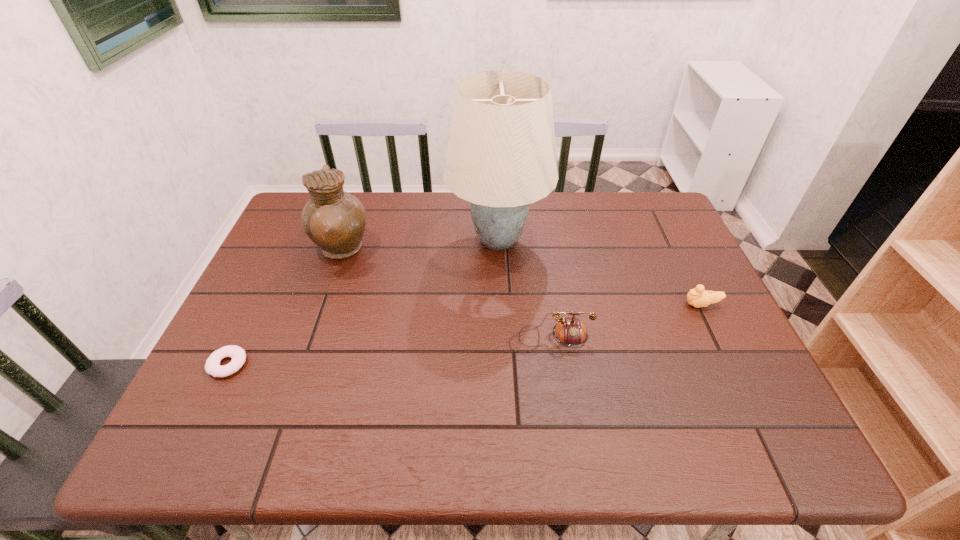
Find the location of a particular element. the tallest object is located at coordinates (501, 156).

This screenshot has height=540, width=960. I want to click on the second object from left to right, so click(x=335, y=220).

I want to click on the fourth shortest object, so click(335, 220).

This screenshot has height=540, width=960. I want to click on telephone, so click(x=570, y=332).

Find the location of a particular element. the rightmost object is located at coordinates (698, 297).

Where is `the third nearest object`? the third nearest object is located at coordinates (698, 297).

Where is `the shortest object`? The width and height of the screenshot is (960, 540). the shortest object is located at coordinates (212, 367).

Find the location of `the leftmost object`. the leftmost object is located at coordinates (212, 367).

The width and height of the screenshot is (960, 540). What are the coordinates of `vacant space located on the front of the tallest object` in the screenshot? It's located at (501, 296).

You are a GUI agent. You are given a task and a screenshot of the screen. Output one action in this format:
    pyautogui.click(x=<x>, y=<y>)
    Task: Click on the free space located at the spout of the pitcher
    This screenshot has height=540, width=960.
    Given the screenshot: What is the action you would take?
    pyautogui.click(x=395, y=251)